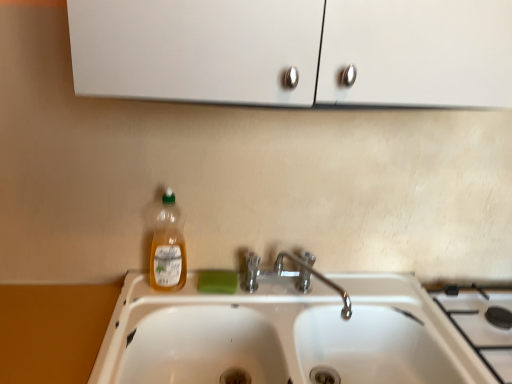
Locate an element on the screen. The image size is (512, 384). free space in front of translucent plastic bottle at center is located at coordinates point(146,309).